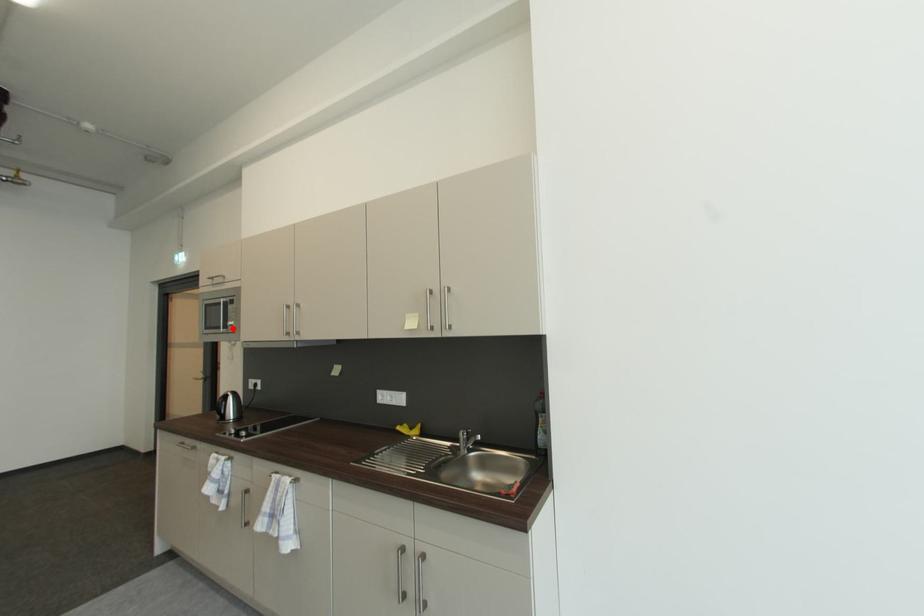
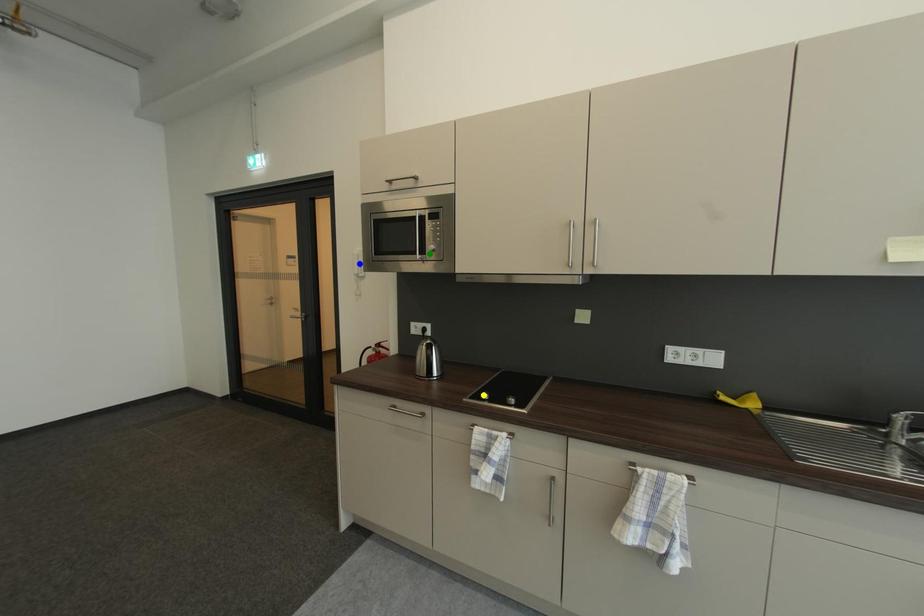
Question: I am providing you with two images of the same scene from different viewpoints. A red point is marked on the first image. You are given multiple points on the second image. Which mark in image 2 goes with the point in image 1?

Choices:
 (A) yellow point
 (B) blue point
 (C) green point

Answer: (C)